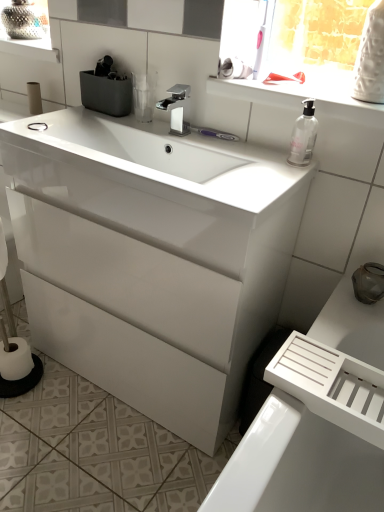
You are a GUI agent. You are given a task and a screenshot of the screen. Output one action in this format:
    pyautogui.click(x=<x>, y=<y>)
    Task: Click on the free space in front of clear glass soap dispenser at upper right
    The height and width of the screenshot is (512, 384).
    Given the screenshot: What is the action you would take?
    pyautogui.click(x=273, y=179)